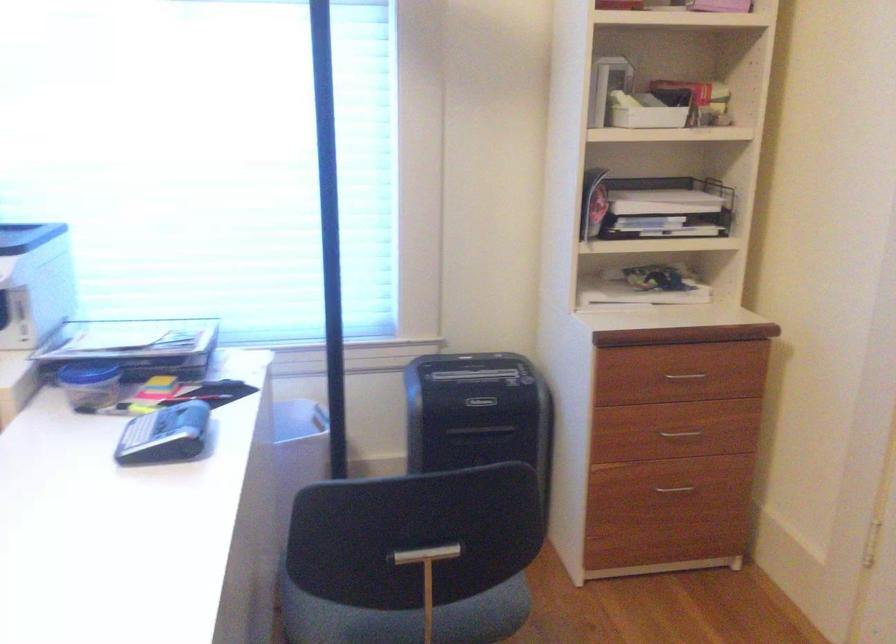
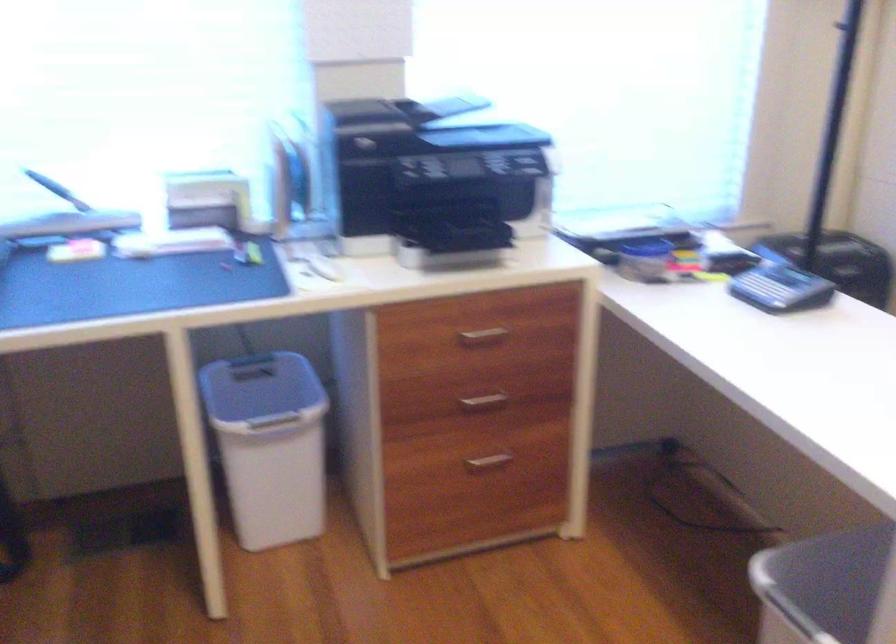
In the second image, find the point that corresponds to [166,427] in the first image.

(780, 288)